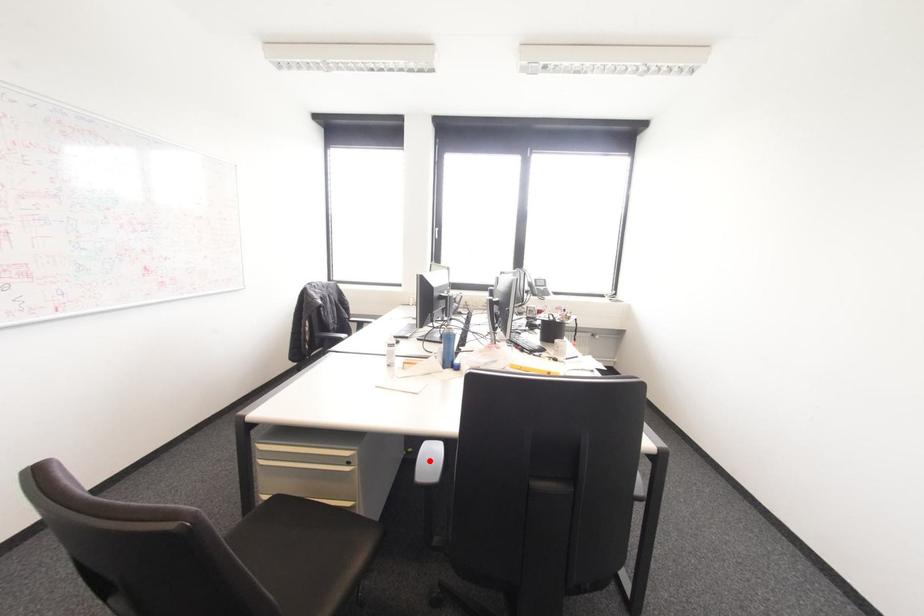
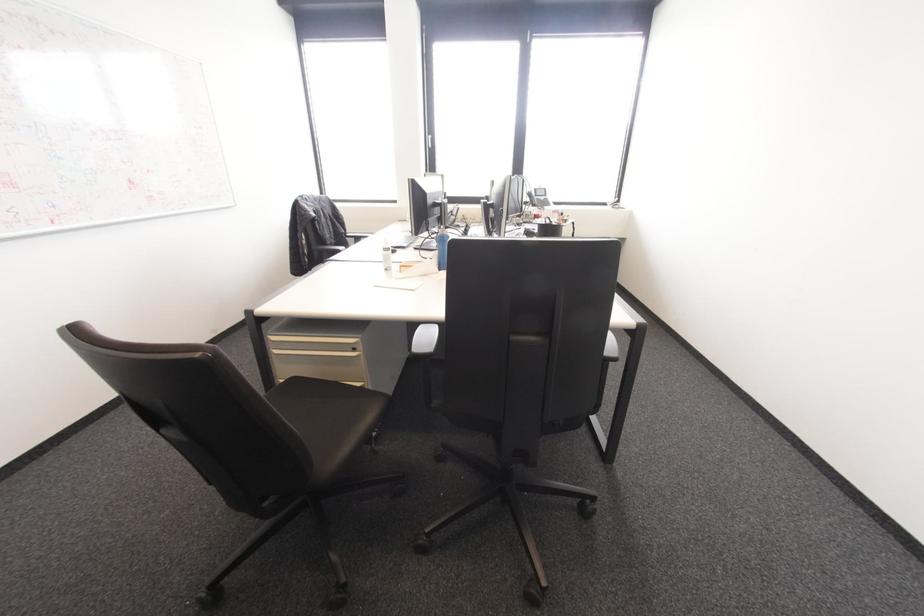
Find the pixel in the second image that matches the highlighted location in the first image.

(426, 339)